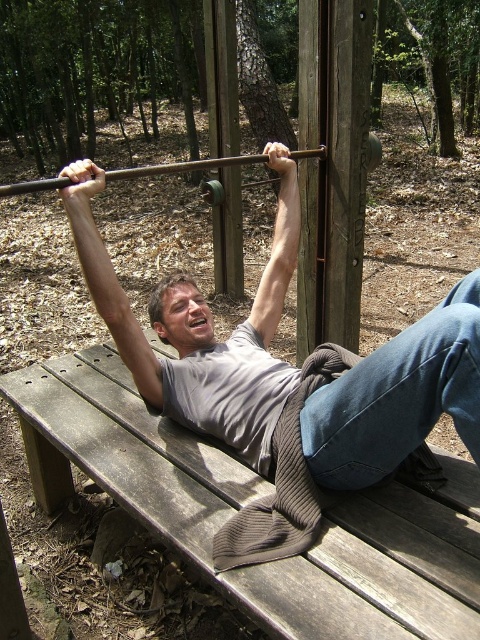
Question: Where is gray matte shirt at center located in relation to wooden barbell at center in the image?

Choices:
 (A) below
 (B) above

Answer: (A)

Question: Which point is closer to the camera?

Choices:
 (A) (357, 467)
 (B) (56, 186)

Answer: (A)

Question: Which object is the farthest from the wooden barbell at center?

Choices:
 (A) wooden bench at center
 (B) gray matte shirt at center

Answer: (B)

Question: Is gray matte shirt at center positioned in front of wooden barbell at center?

Choices:
 (A) yes
 (B) no

Answer: (A)

Question: Considering the real-world distances, which object is closest to the wooden bench at center?

Choices:
 (A) gray matte shirt at center
 (B) wooden barbell at center

Answer: (A)

Question: Is gray matte shirt at center wider than wooden barbell at center?

Choices:
 (A) yes
 (B) no

Answer: (B)